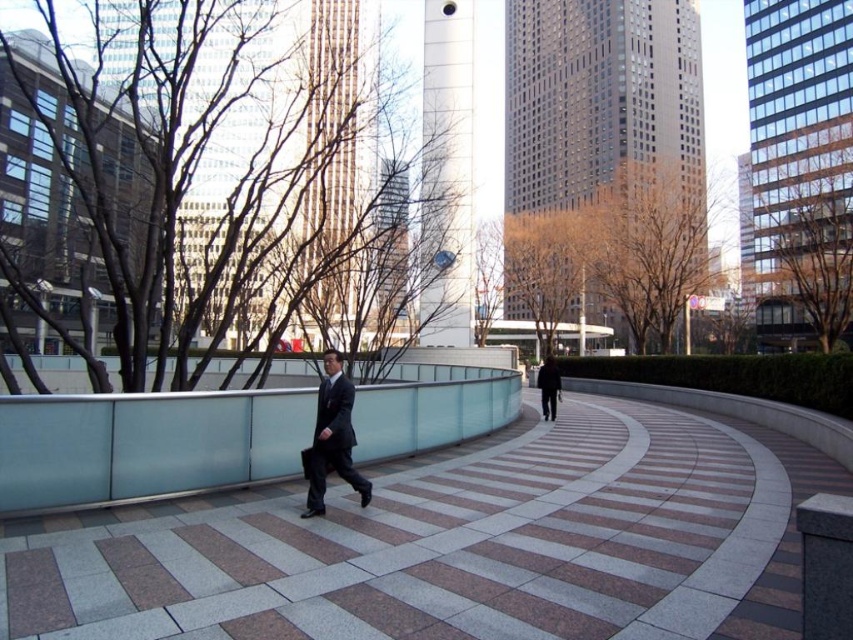
Question: Estimate the real-world distances between objects in this image. Which object is farther from the dark gray suit at center?

Choices:
 (A) granite walkway at center
 (B) black matte jacket at center

Answer: (B)

Question: Considering the relative positions of dark gray suit at center and black matte jacket at center in the image provided, where is dark gray suit at center located with respect to black matte jacket at center?

Choices:
 (A) left
 (B) right

Answer: (A)

Question: Which point is closer to the camera?

Choices:
 (A) (547, 364)
 (B) (322, 420)

Answer: (B)

Question: Is dark gray suit at center below black matte jacket at center?

Choices:
 (A) no
 (B) yes

Answer: (A)

Question: Which of the following is the farthest from the observer?

Choices:
 (A) (354, 440)
 (B) (543, 385)

Answer: (B)

Question: Does dark gray suit at center appear over black matte jacket at center?

Choices:
 (A) yes
 (B) no

Answer: (A)